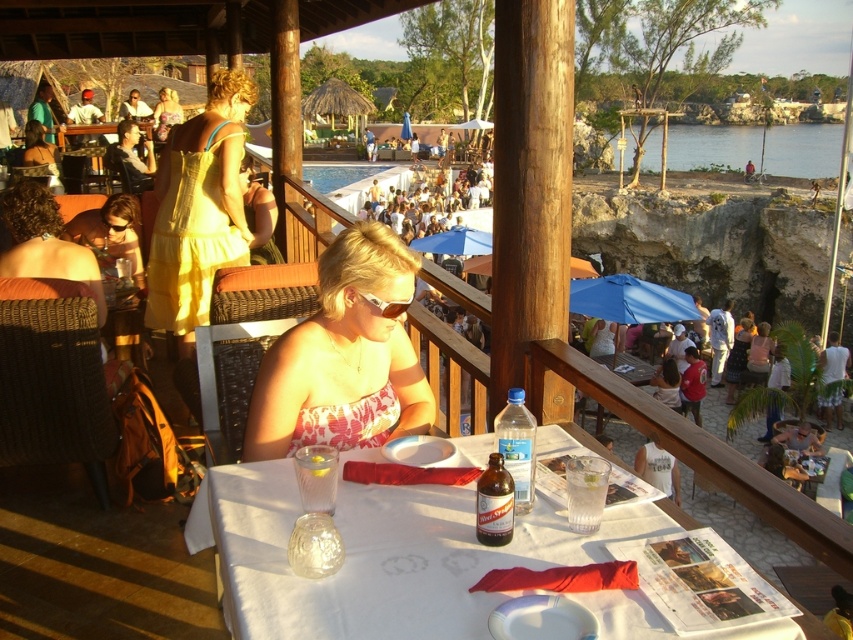
Question: Is white paper table at center smaller than yellow cotton dress at upper left?

Choices:
 (A) no
 (B) yes

Answer: (B)

Question: Which of the following is the closest to the observer?

Choices:
 (A) pink strapless dress at center
 (B) yellow cotton dress at upper left
 (C) blue fabric umbrella at center

Answer: (A)

Question: Which of these objects is positioned closest to the yellow cotton dress at upper left?

Choices:
 (A) blue water at lower right
 (B) blue fabric umbrella at center
 (C) pink strapless dress at center
 (D) white paper table at center

Answer: (C)

Question: Estimate the real-world distances between objects in this image. Which object is farther from the pink strapless dress at center?

Choices:
 (A) blue fabric umbrella at center
 (B) blue water at lower right
 (C) yellow cotton dress at upper left
 (D) white paper table at center

Answer: (B)

Question: Does pink strapless dress at center appear on the right side of yellow cotton dress at upper left?

Choices:
 (A) yes
 (B) no

Answer: (A)

Question: Is yellow cotton dress at upper left to the left of blue fabric umbrella at center from the viewer's perspective?

Choices:
 (A) yes
 (B) no

Answer: (A)